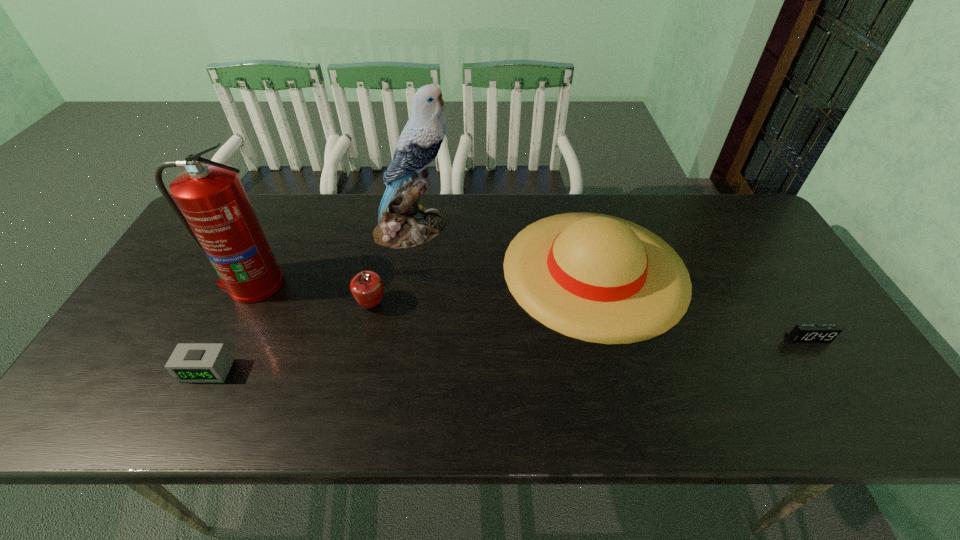
I want to click on free space between the fire extinguisher and the third shortest object, so click(x=312, y=294).

Choose which object is the fourth nearest neighbor to the nearer alarm clock. Please provide its 2D coordinates. Your answer should be formatted as a tuple, i.e. [(x, y)], where the tuple contains the x and y coordinates of a point satisfying the conditions above.

[(598, 278)]

You are a GUI agent. You are given a task and a screenshot of the screen. Output one action in this format:
    pyautogui.click(x=<x>, y=<y>)
    Task: Click on the object that is the third nearest to the fire extinguisher
    The image size is (960, 540).
    Given the screenshot: What is the action you would take?
    pyautogui.click(x=402, y=223)

Find the location of a particular element. free space that satisfies the following two spatial constraints: 1. on the instruction side of the apple; 2. on the left side of the fire extinguisher is located at coordinates (243, 304).

Where is `free space that satisfies the following two spatial constraints: 1. on the face of the parakeet; 2. on the front side of the third shortest object`? The height and width of the screenshot is (540, 960). free space that satisfies the following two spatial constraints: 1. on the face of the parakeet; 2. on the front side of the third shortest object is located at coordinates (400, 304).

The width and height of the screenshot is (960, 540). In order to click on vacant space that satisfies the following two spatial constraints: 1. on the face of the parakeet; 2. on the front-facing side of the nearest object in this screenshot , I will do `click(390, 370)`.